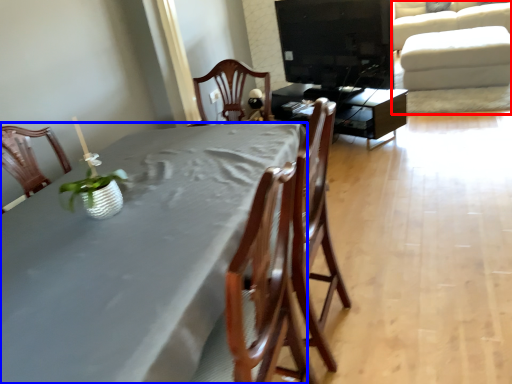
Question: Which object is further to the camera taking this photo, couch (highlighted by a red box) or table (highlighted by a blue box)?

Choices:
 (A) couch
 (B) table

Answer: (A)